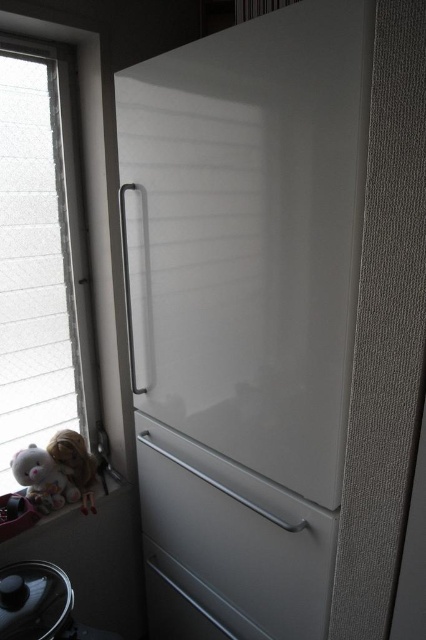
Is point (164, 499) positioned after point (55, 465)?

That is False.

Does satin silver drawer at lower center have a lesser height compared to fluffy white teddy bear at lower left?

Incorrect, satin silver drawer at lower center's height does not fall short of fluffy white teddy bear at lower left's.

Which is in front, point (181, 621) or point (54, 470)?

Point (54, 470)

The width and height of the screenshot is (426, 640). What are the coordinates of `satin silver drawer at lower center` in the screenshot? It's located at (233, 540).

Is point (150, 515) farther from camera compared to point (77, 464)?

No, it is in front of (77, 464).

Which is below, satin silver drawer at lower center or matte plastic doll at lower left?

Positioned lower is satin silver drawer at lower center.

Which is in front, point (207, 481) or point (80, 502)?

Point (207, 481)

Identify the location of satin silver drawer at lower center. (233, 540).

Which is more to the right, white glossy refrigerator at center or satin silver drawer at lower center?

white glossy refrigerator at center is more to the right.

Is point (313, 586) positioned after point (328, 577)?

Yes, point (313, 586) is farther from viewer.

This screenshot has width=426, height=640. I want to click on white glossy refrigerator at center, so pos(244,312).